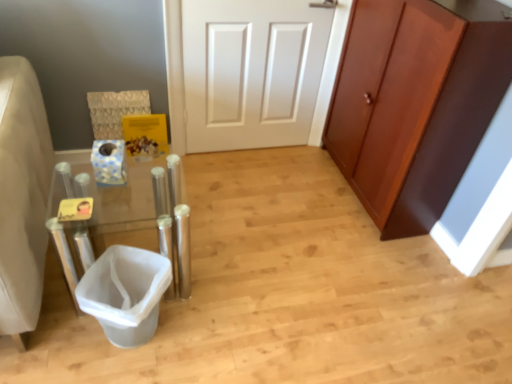
This screenshot has width=512, height=384. Identify the location of white plastic trash can at lower left. (125, 293).

What do you see at coordinates (110, 207) in the screenshot? I see `clear acrylic vanity at left` at bounding box center [110, 207].

What is the approximate height of brown wood cabinet at right?

3.43 feet.

Locate an element on the screen. The width and height of the screenshot is (512, 384). white plastic trash can at lower left is located at coordinates (125, 293).

Who is bigger, clear acrylic vanity at left or white plastic trash can at lower left?

clear acrylic vanity at left.

Does clear acrylic vanity at left have a lesser height compared to white plastic trash can at lower left?

No, clear acrylic vanity at left is not shorter than white plastic trash can at lower left.

Between clear acrylic vanity at left and white plastic trash can at lower left, which one is positioned in front?

clear acrylic vanity at left is in front.

Looking at their sizes, would you say clear acrylic vanity at left is wider or thinner than white plastic trash can at lower left?

Clearly, clear acrylic vanity at left has more width compared to white plastic trash can at lower left.

Is white plastic trash can at lower left facing away from brown wood cabinet at right?

No, white plastic trash can at lower left is not facing the opposite direction of brown wood cabinet at right.

Which is more distant, (127, 308) or (431, 24)?

The point (431, 24) is more distant.

In terms of size, does white plastic trash can at lower left appear bigger or smaller than brown wood cabinet at right?

Considering their sizes, white plastic trash can at lower left takes up less space than brown wood cabinet at right.

How much distance is there between brown wood cabinet at right and white plastic trash can at lower left?

The distance of brown wood cabinet at right from white plastic trash can at lower left is 1.21 meters.

Considering the sizes of objects brown wood cabinet at right and white plastic trash can at lower left in the image provided, who is bigger, brown wood cabinet at right or white plastic trash can at lower left?

Bigger between the two is brown wood cabinet at right.

In the scene shown: Can you confirm if brown wood cabinet at right is shorter than white plastic trash can at lower left?

Incorrect, the height of brown wood cabinet at right does not fall short of that of white plastic trash can at lower left.

Can you confirm if brown wood cabinet at right is positioned to the left of white plastic trash can at lower left?

In fact, brown wood cabinet at right is to the right of white plastic trash can at lower left.

Is clear acrylic vanity at left placed right next to brown wood cabinet at right?

They are not placed beside each other.

Is clear acrylic vanity at left oriented away from brown wood cabinet at right?

No, clear acrylic vanity at left's orientation is not away from brown wood cabinet at right.

The height and width of the screenshot is (384, 512). I want to click on vanity that is below the brown wood cabinet at right (from the image's perspective), so click(110, 207).

Choose the correct answer: Is clear acrylic vanity at left inside brown wood cabinet at right or outside it?

clear acrylic vanity at left exists outside the volume of brown wood cabinet at right.

From the image's perspective, is brown wood cabinet at right located beneath clear acrylic vanity at left?

Incorrect, from the image's perspective, brown wood cabinet at right is higher than clear acrylic vanity at left.

Based on their positions, is brown wood cabinet at right located to the left or right of clear acrylic vanity at left?

In the image, brown wood cabinet at right appears on the right side of clear acrylic vanity at left.

Does point (426, 173) appear closer or farther from the camera than point (55, 191)?

Point (426, 173).

From a real-world perspective, does brown wood cabinet at right sit lower than clear acrylic vanity at left?

No, from a real-world perspective, brown wood cabinet at right is not beneath clear acrylic vanity at left.

In the scene shown: From the image's perspective, which object appears higher, white plastic trash can at lower left or clear acrylic vanity at left?

From the image's view, clear acrylic vanity at left is above.

In the image, there is a clear acrylic vanity at left. Where is `toilet bowl below it (from a real-world perspective)`? toilet bowl below it (from a real-world perspective) is located at coordinates 125,293.

Is white plastic trash can at lower left behind clear acrylic vanity at left?

Yes, it is.

From the picture: From their relative heights in the image, would you say white plastic trash can at lower left is taller or shorter than clear acrylic vanity at left?

Clearly, white plastic trash can at lower left is shorter compared to clear acrylic vanity at left.

Image resolution: width=512 pixels, height=384 pixels. In the image, there is a clear acrylic vanity at left. Find the location of `toilet bowl below it (from a real-world perspective)`. toilet bowl below it (from a real-world perspective) is located at coordinates (125, 293).

Where is `toilet bowl located on the left of brown wood cabinet at right`? The width and height of the screenshot is (512, 384). toilet bowl located on the left of brown wood cabinet at right is located at coordinates (125, 293).

Estimate the real-world distances between objects in this image. Which object is further from white plastic trash can at lower left, brown wood cabinet at right or clear acrylic vanity at left?

brown wood cabinet at right.

Considering their positions, is white plastic trash can at lower left positioned further to brown wood cabinet at right than clear acrylic vanity at left?

white plastic trash can at lower left is positioned further to the anchor brown wood cabinet at right.

From the image, which object appears to be nearer to clear acrylic vanity at left, white plastic trash can at lower left or brown wood cabinet at right?

white plastic trash can at lower left.

From the image, which object appears to be nearer to brown wood cabinet at right, clear acrylic vanity at left or white plastic trash can at lower left?

clear acrylic vanity at left is positioned closer to the anchor brown wood cabinet at right.

When comparing their distances from clear acrylic vanity at left, does brown wood cabinet at right or white plastic trash can at lower left seem further?

brown wood cabinet at right lies further to clear acrylic vanity at left than the other object.

Based on their spatial positions, is clear acrylic vanity at left or brown wood cabinet at right further from white plastic trash can at lower left?

The object further to white plastic trash can at lower left is brown wood cabinet at right.

Where is `toilet bowl situated between clear acrylic vanity at left and brown wood cabinet at right from left to right`? toilet bowl situated between clear acrylic vanity at left and brown wood cabinet at right from left to right is located at coordinates (125, 293).